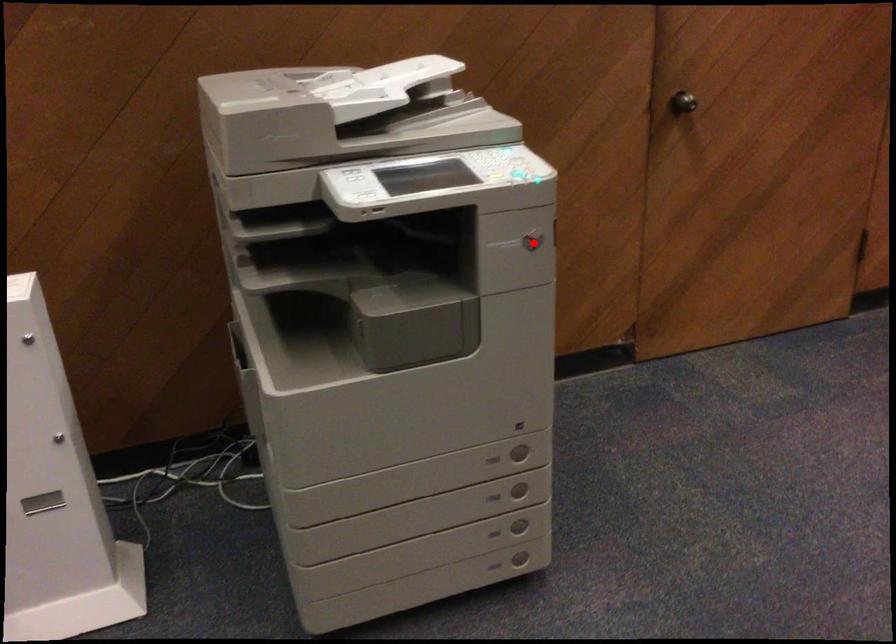
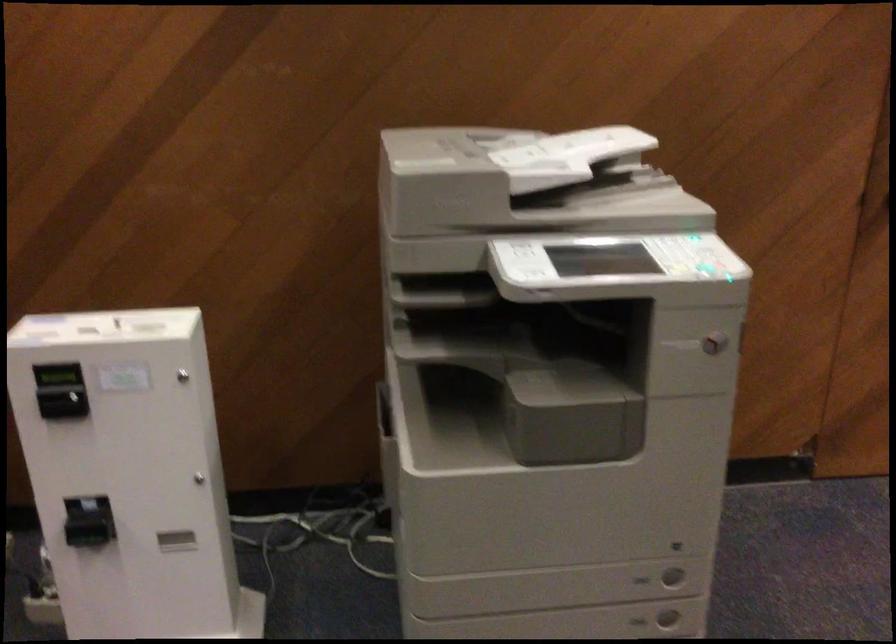
Find the pixel in the second image that matches the highlighted location in the first image.

(713, 343)